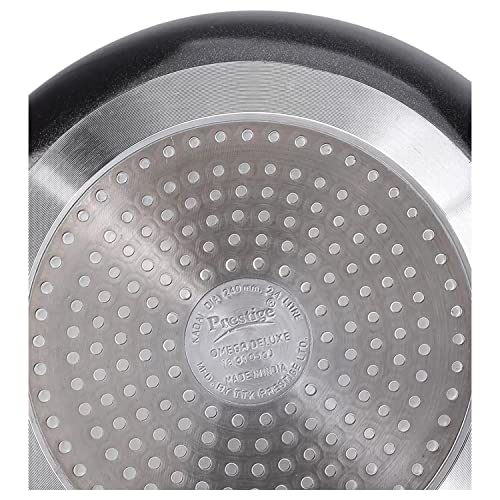
Identify the location of large round bottom plate. pos(385,327).